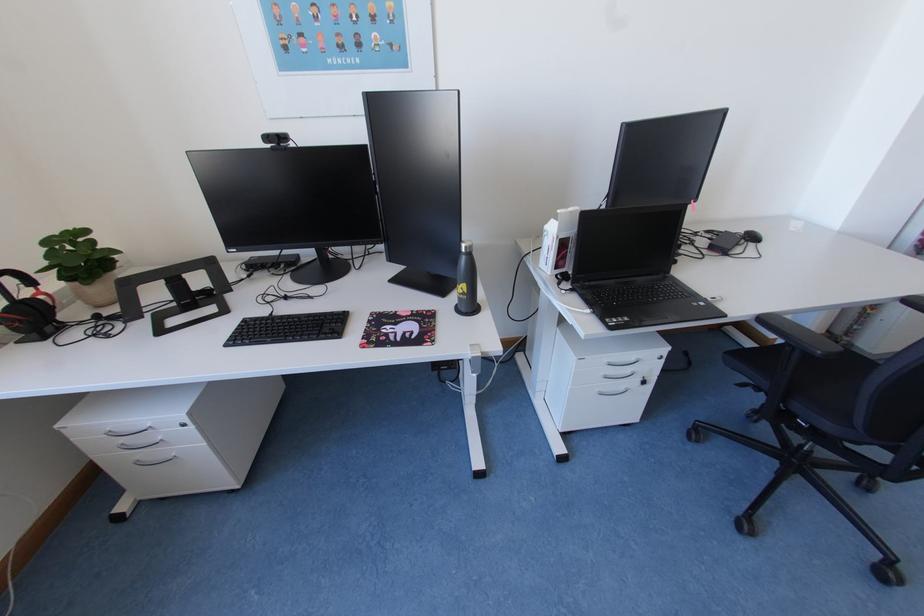
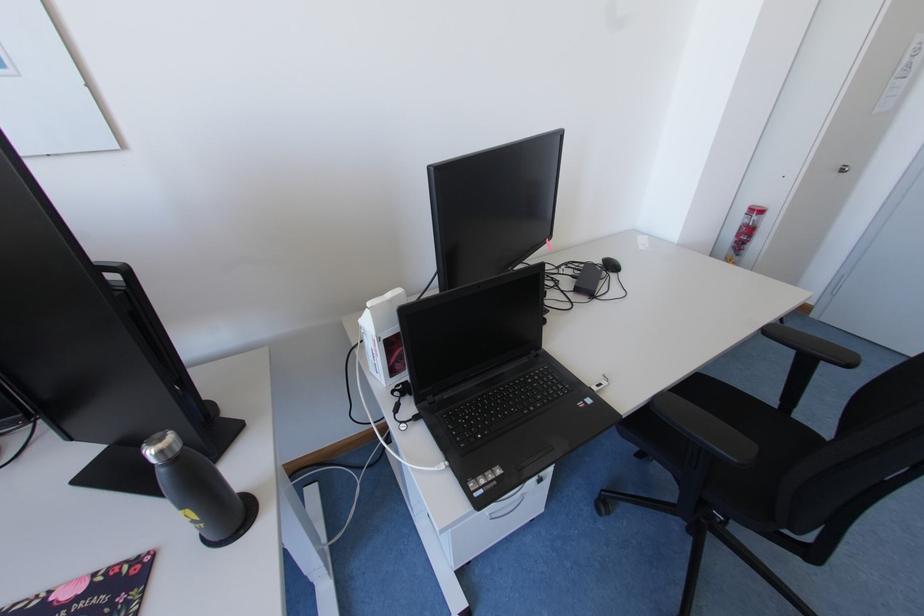
Which direction would the cameraman need to move to produce the second image?

The cameraman walked toward right, forward.